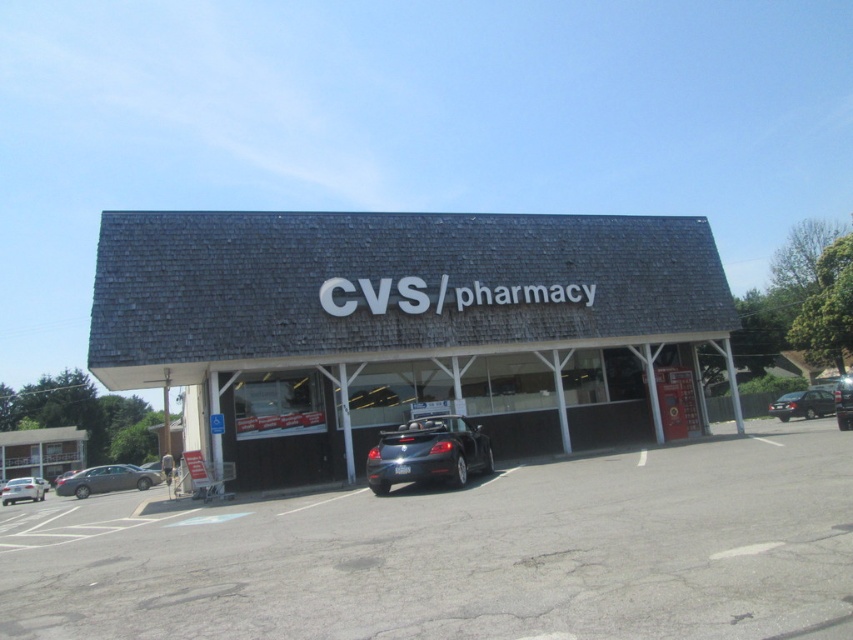
Question: Which point appears farthest from the camera in this image?

Choices:
 (A) (395, 467)
 (B) (61, 492)

Answer: (B)

Question: Can you confirm if gray shingles cvs/pharmacy at center is positioned to the right of satin black sedan at right?

Choices:
 (A) no
 (B) yes

Answer: (A)

Question: Which point appears closest to the camera in this image?

Choices:
 (A) (57, 493)
 (B) (218, 349)
 (C) (686, 536)
 (D) (453, 461)

Answer: (C)

Question: Is gray shingles cvs/pharmacy at center wider than silver metallic sedan at lower left?

Choices:
 (A) yes
 (B) no

Answer: (A)

Question: Estimate the real-world distances between objects in this image. Which object is closer to the asphalt at center?

Choices:
 (A) satin black sedan at right
 (B) silver metallic sedan at lower left

Answer: (A)

Question: Is asphalt at center positioned at the back of satin black sedan at right?

Choices:
 (A) no
 (B) yes

Answer: (A)